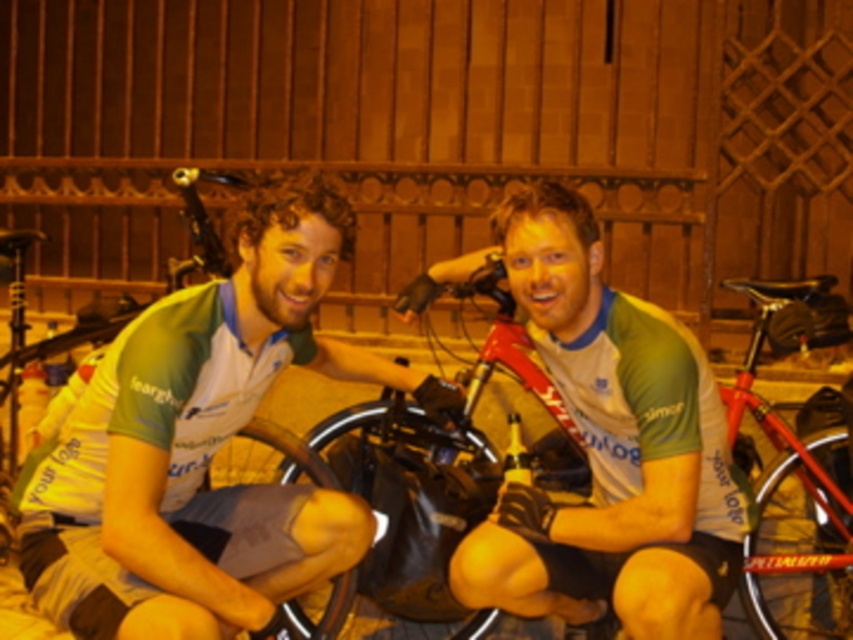
In the scene shown: You are a photographer trying to capture a closeup of the green jersey at center and the red matte bicycle at center. Since you want both items to appear the same size in the photo, which object should you move closer to the camera and which should you move farther away?

The green jersey at center is bigger than the red matte bicycle at center. To make them appear the same size in the photo, move the smaller red matte bicycle at center closer to the camera and move the larger green jersey at center farther away.

You are a photographer trying to capture a photo of the green jersey at center and the red matte bicycle at center. You want to ensure both are fully visible in the frame. Considering their sizes, which object should you prioritize positioning closer to the camera to avoid cropping?

The green jersey at center is wider than the red matte bicycle at center. To avoid cropping, prioritize positioning the green jersey at center closer to the camera since its larger width requires more space in the frame.